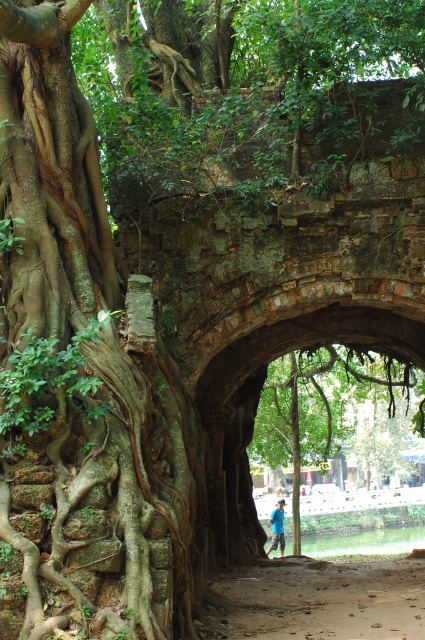
You are a hiker who wants to take a photo of the brown dirt path at center without the green rough bark tree at center blocking the view. Is it possible to stand somewhere where the tree won

The green rough bark tree at center is much taller than the brown dirt path at center, so if you position yourself at a lower elevation or angle yourself away from the tree, you can capture the brown dirt path at center without the tree obstructing the view.

You are a hiker standing at the riverside path and want to take a photo of both the brown rough bark banyan tree at left and the green rough bark tree at center. Which tree should you move closer to in order to capture both trees fully in the frame?

The brown rough bark banyan tree at left is shorter than the green rough bark tree at center. To capture both trees fully in the frame, you should move closer to the taller green rough bark tree at center so that the shorter tree remains within the camera view.

You are a photographer planning to capture the brown rough bark banyan tree at left and the blue fabric shirt at center in your shot. Based on their sizes, which object should you focus on first if you want to ensure both are fully visible in the frame?

The brown rough bark banyan tree at left might be wider than the blue fabric shirt at center, so focusing on the tree first would help ensure both are fully visible.